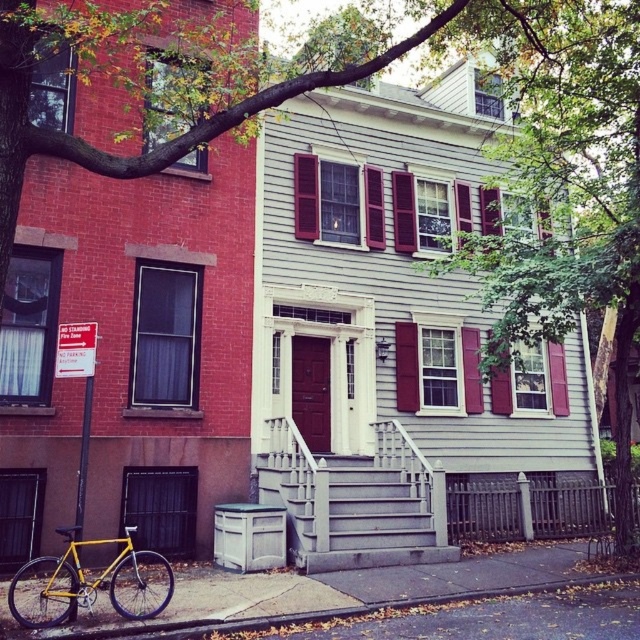
Question: From the image, what is the correct spatial relationship of gray wooden stairs at center in relation to yellow matte bicycle at lower left?

Choices:
 (A) below
 (B) above

Answer: (B)

Question: Among these objects, which one is nearest to the camera?

Choices:
 (A) gray wooden stairs at center
 (B) yellow matte bicycle at lower left

Answer: (B)

Question: Which of the following is the farthest from the observer?

Choices:
 (A) gray wooden stairs at center
 (B) yellow matte bicycle at lower left

Answer: (A)

Question: Can you confirm if gray wooden stairs at center is smaller than yellow matte bicycle at lower left?

Choices:
 (A) yes
 (B) no

Answer: (B)

Question: Can you confirm if gray wooden stairs at center is positioned to the left of yellow matte bicycle at lower left?

Choices:
 (A) yes
 (B) no

Answer: (B)